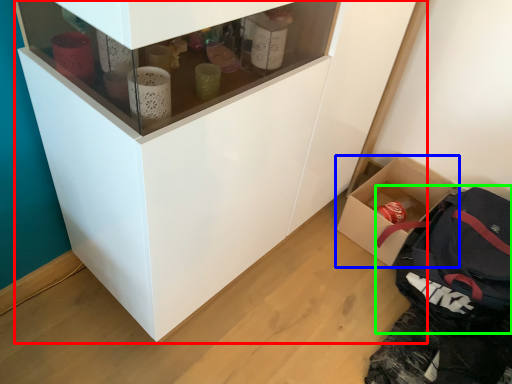
Question: Which object is positioned farthest from cupboard (highlighted by a red box)? Select from box (highlighted by a blue box) and backpack (highlighted by a green box).

Choices:
 (A) box
 (B) backpack

Answer: (A)